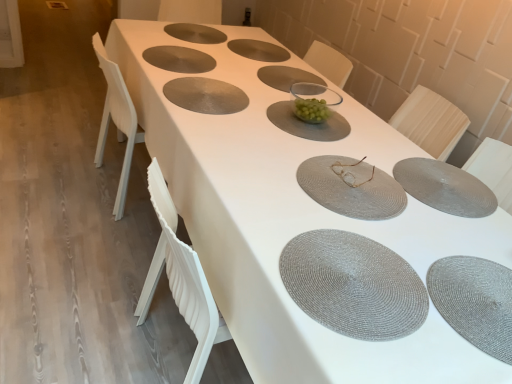
Identify the location of vacant area located to the right-hand side of gray woven placemat at center. Image resolution: width=512 pixels, height=384 pixels. (268, 110).